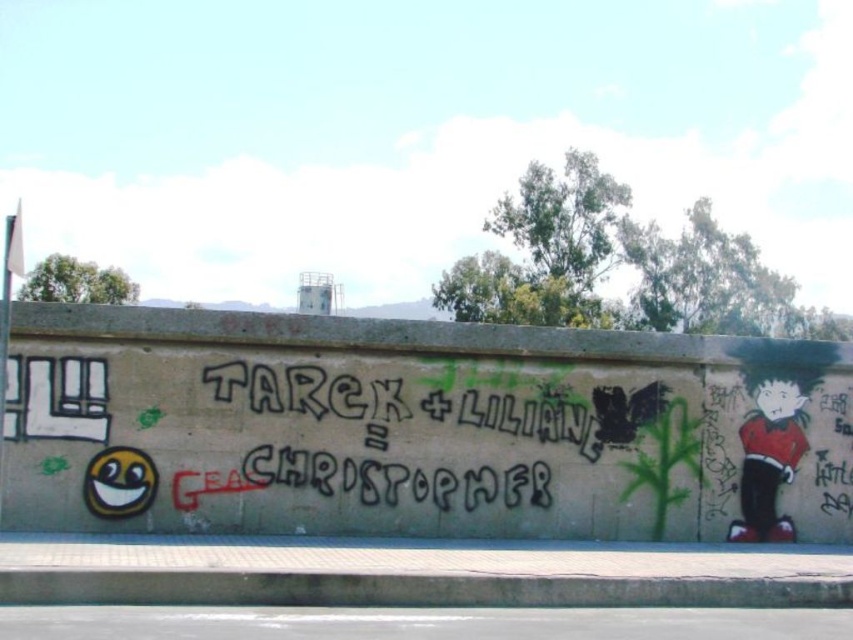
Question: Is black spray paint graffiti at center below red glossy skateboarder at right?

Choices:
 (A) no
 (B) yes

Answer: (A)

Question: Which object appears farthest from the camera in this image?

Choices:
 (A) red glossy skateboarder at right
 (B) black spray paint graffiti at center

Answer: (A)

Question: Is black spray paint graffiti at center to the right of red glossy skateboarder at right from the viewer's perspective?

Choices:
 (A) yes
 (B) no

Answer: (B)

Question: Among these objects, which one is farthest from the camera?

Choices:
 (A) red glossy skateboarder at right
 (B) black spray paint graffiti at center

Answer: (A)

Question: Can you confirm if black spray paint graffiti at center is smaller than red glossy skateboarder at right?

Choices:
 (A) yes
 (B) no

Answer: (B)